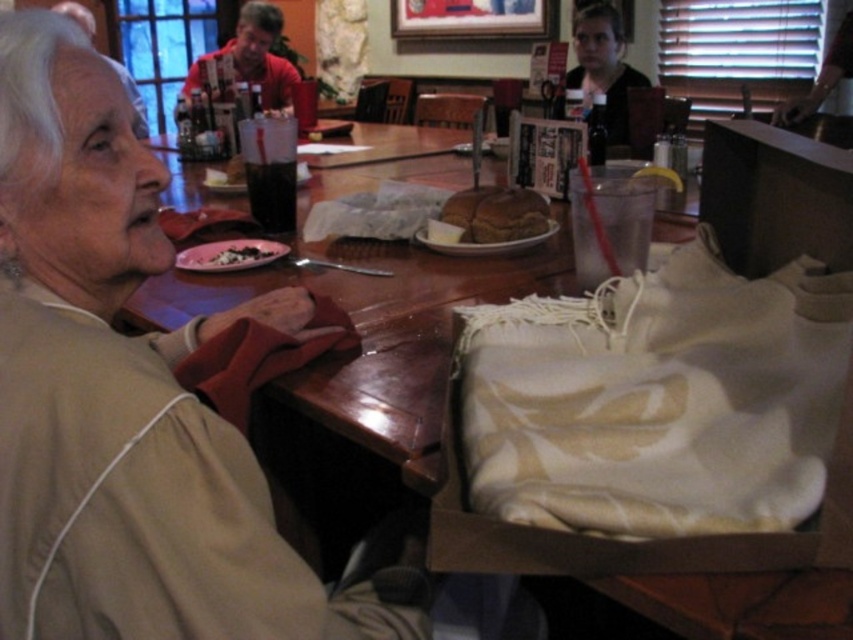
You are a customer sitting at the wooden table at center in a restaurant. You want to reach for the glass of water with a lemon slice and a red straw that is placed on the table. Considering the table is 68.09 centimeters away from you, can you comfortably reach it without leaving your seat?

The wooden table at center is 68.09 centimeters away from the viewer, so yes, you can comfortably reach the glass of water with a lemon slice and a red straw placed on the table without leaving your seat, as typical arm length for adults is around 60 to 70 centimeters.